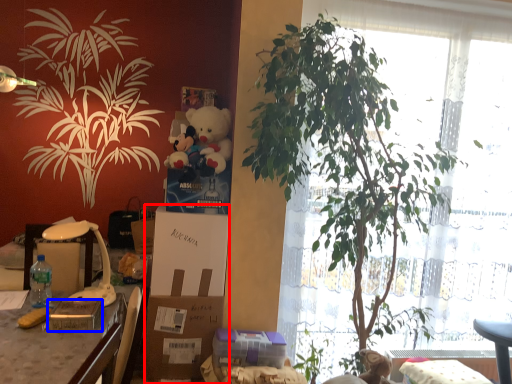
Question: Among these objects, which one is farthest to the camera, box (highlighted by a red box) or gift (highlighted by a blue box)?

Choices:
 (A) box
 (B) gift

Answer: (A)